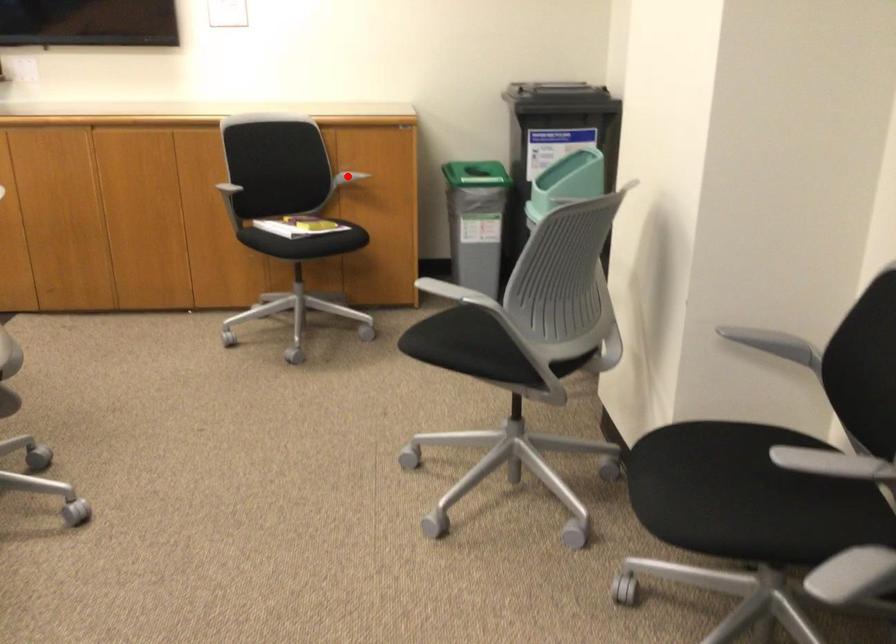
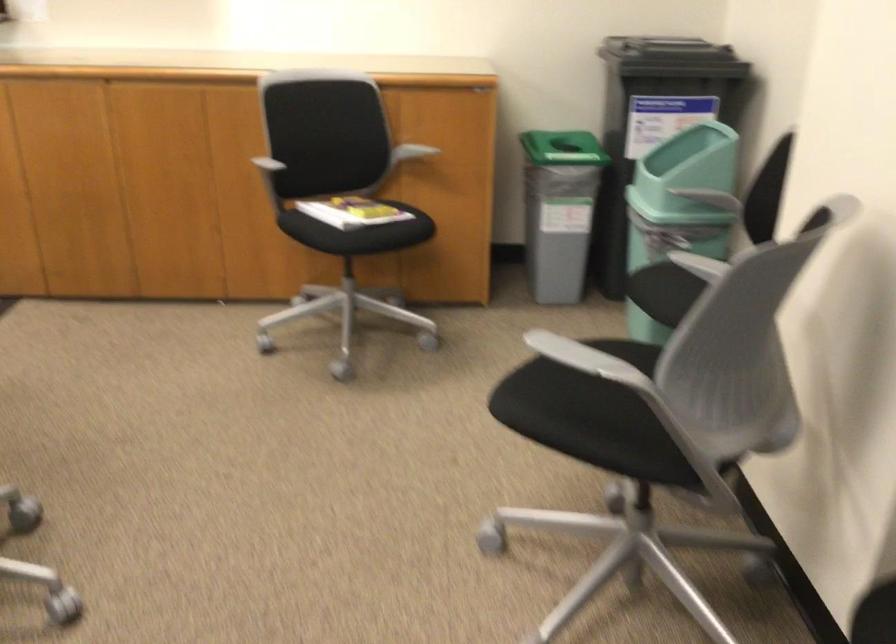
Question: I am providing you with two images of the same scene from different viewpoints. A red point is shown in image1. For the corresponding object point in image2, is it positioned nearer or farther from the camera?

Choices:
 (A) Nearer
 (B) Farther

Answer: (A)